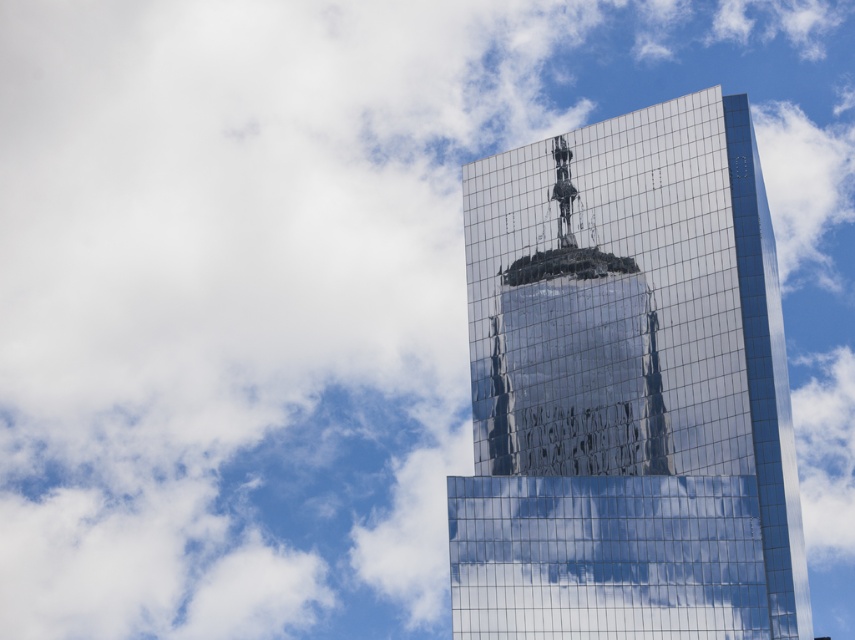
Is reflective glass tower at center taller than glossy glass skyscraper at center?

Indeed, reflective glass tower at center has a greater height compared to glossy glass skyscraper at center.

This screenshot has width=855, height=640. Find the location of `reflective glass tower at center`. reflective glass tower at center is located at coordinates (628, 388).

Who is more distant from viewer, (541, 323) or (568, 465)?

The point (541, 323) is behind.

This screenshot has height=640, width=855. What are the coordinates of `reflective glass tower at center` in the screenshot? It's located at (628, 388).